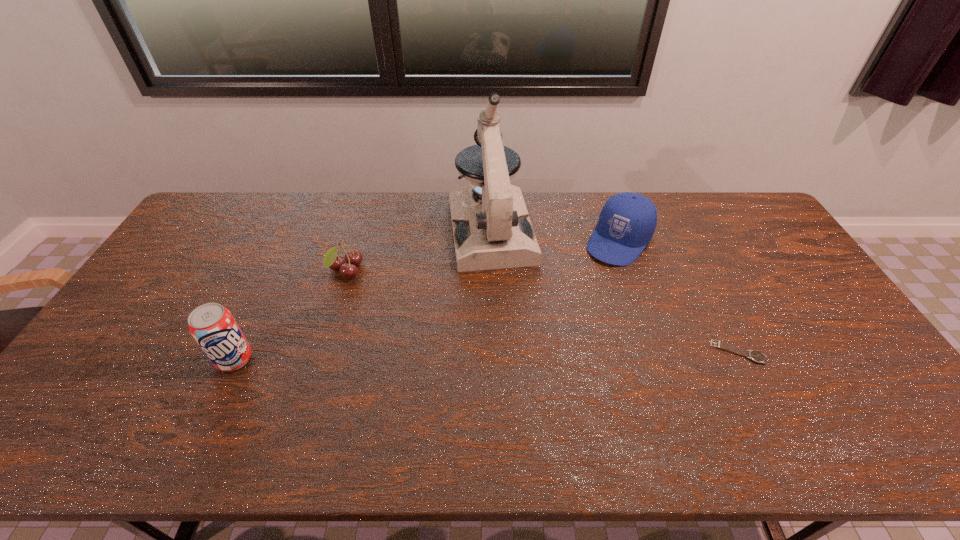
Locate an element on the screen. The height and width of the screenshot is (540, 960). microscope that is positioned at the far edge is located at coordinates (491, 226).

Where is `cap located in the far edge section of the desktop`? cap located in the far edge section of the desktop is located at coordinates (627, 221).

In the image, there is a desktop. Identify the location of vacant space at the far edge. (344, 204).

This screenshot has height=540, width=960. In the image, there is a desktop. What are the coordinates of `blank space at the near edge` in the screenshot? It's located at (658, 404).

What are the coordinates of `vacant space at the left edge of the desktop` in the screenshot? It's located at (207, 250).

Where is `vacant space at the right edge`? vacant space at the right edge is located at coordinates (823, 301).

Find the location of `vacant point at the far left corner`. vacant point at the far left corner is located at coordinates (207, 228).

Image resolution: width=960 pixels, height=540 pixels. What are the coordinates of `free location at the near left corner of the desktop` in the screenshot? It's located at (78, 396).

The image size is (960, 540). Find the location of `vacant area at the near right corner of the desktop`. vacant area at the near right corner of the desktop is located at coordinates (840, 403).

The width and height of the screenshot is (960, 540). In order to click on vacant area between the cap and the rightmost object in this screenshot , I will do `click(679, 296)`.